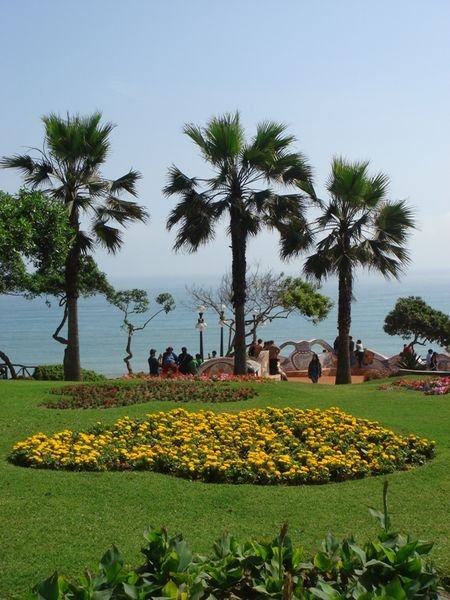
Image resolution: width=450 pixels, height=600 pixels. Find the location of `lights`. lights is located at coordinates (199, 306), (222, 307), (255, 313).